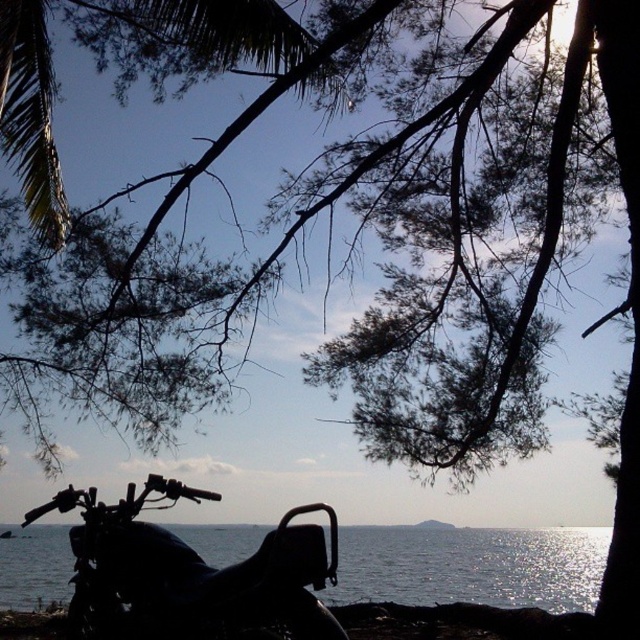
What do you see at coordinates (189, 573) in the screenshot? This screenshot has height=640, width=640. I see `black matte motorcycle at lower left` at bounding box center [189, 573].

Does black matte motorcycle at lower left appear on the left side of transparent water at lower center?

Yes, black matte motorcycle at lower left is to the left of transparent water at lower center.

You are a GUI agent. You are given a task and a screenshot of the screen. Output one action in this format:
    pyautogui.click(x=<x>, y=<y>)
    Task: Click on the black matte motorcycle at lower left
    The width and height of the screenshot is (640, 640).
    Given the screenshot: What is the action you would take?
    pyautogui.click(x=189, y=573)